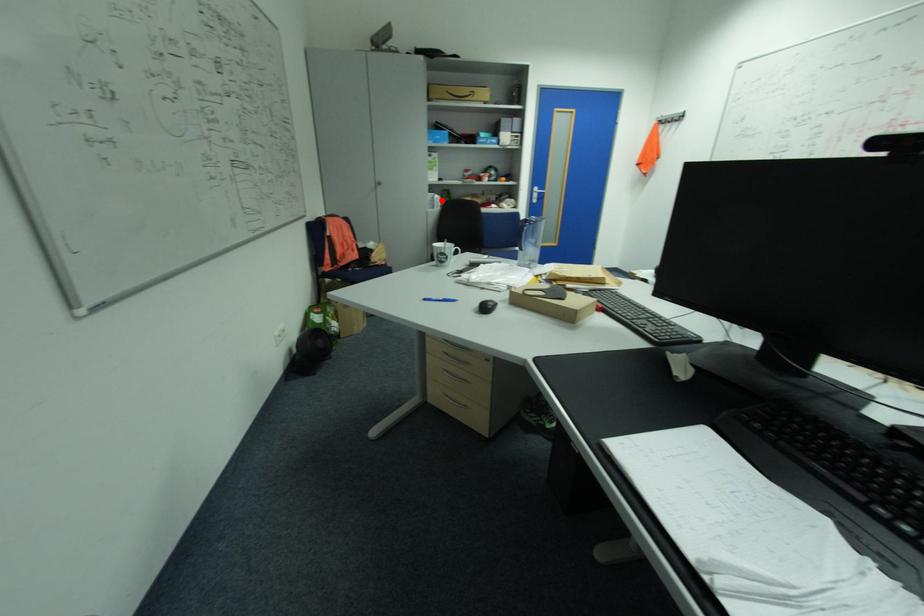
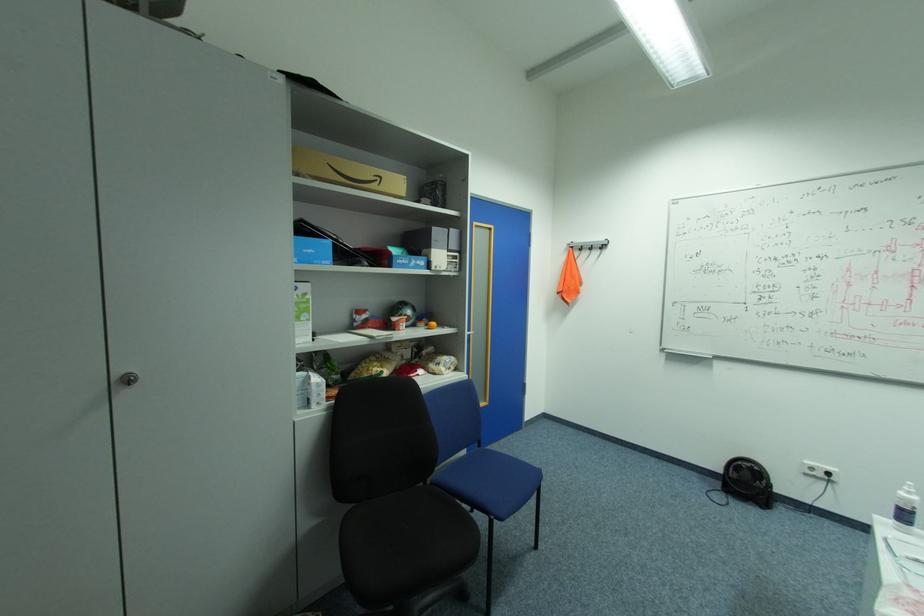
In the second image, find the point that corresponds to the highlighted location in the first image.

(321, 387)